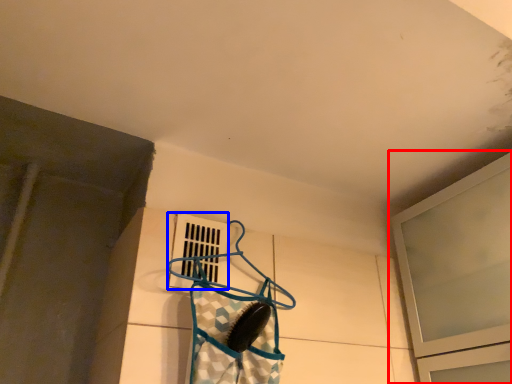
Question: Which object is closer to the camera taking this photo, window (highlighted by a red box) or window (highlighted by a blue box)?

Choices:
 (A) window
 (B) window

Answer: (A)